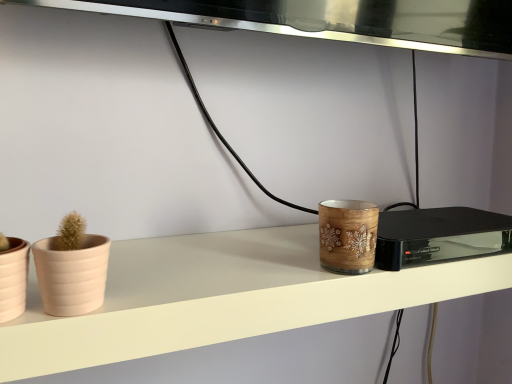
The width and height of the screenshot is (512, 384). I want to click on vacant area that is situated to the right of beige matte flowerpot at left, positioned as the 2th flowerpot in left-to-right order, so click(231, 282).